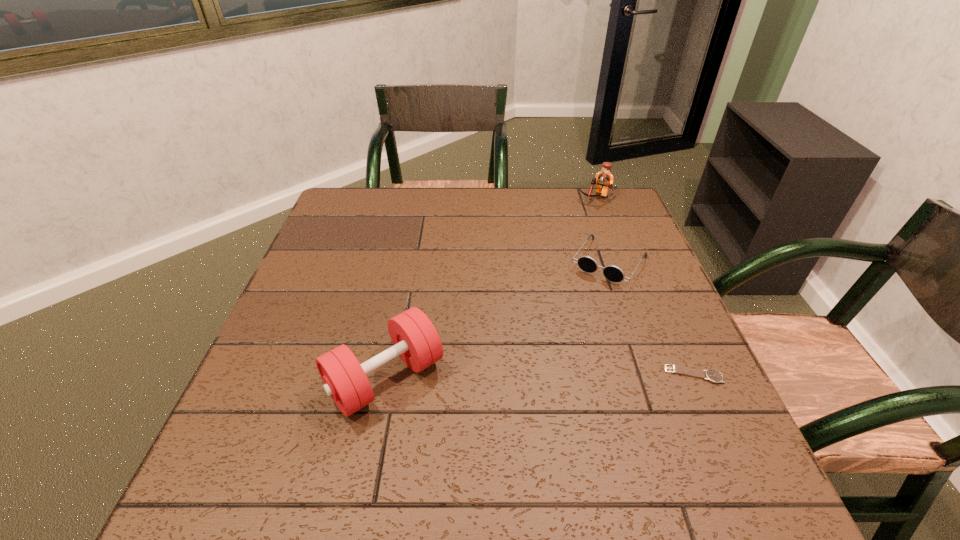
Identify the location of object that is at the far right corner. This screenshot has width=960, height=540. (604, 179).

In the image, there is a desktop. Identify the location of vacant space at the far edge. (516, 190).

The height and width of the screenshot is (540, 960). I want to click on vacant space at the left edge of the desktop, so click(x=341, y=258).

Where is `free space at the right edge of the desktop`? The width and height of the screenshot is (960, 540). free space at the right edge of the desktop is located at coordinates (657, 302).

This screenshot has width=960, height=540. Identify the location of vacant space at the far left corner. (334, 226).

This screenshot has height=540, width=960. I want to click on vacant space at the near left corner of the desktop, so click(255, 442).

Locate an element on the screen. vacant space at the near right corner of the desktop is located at coordinates (695, 423).

You are a GUI agent. You are given a task and a screenshot of the screen. Output one action in this format:
    pyautogui.click(x=<x>, y=<y>)
    Task: Click on the vacant area that lies between the shortest object and the farthest object
    This screenshot has width=960, height=540.
    Given the screenshot: What is the action you would take?
    [x=645, y=286]

Locate an element on the screen. unoccupied position between the second shortest object and the dumbbell is located at coordinates (497, 320).

Locate an element on the screen. free point between the leftmost object and the second shortest object is located at coordinates (497, 320).